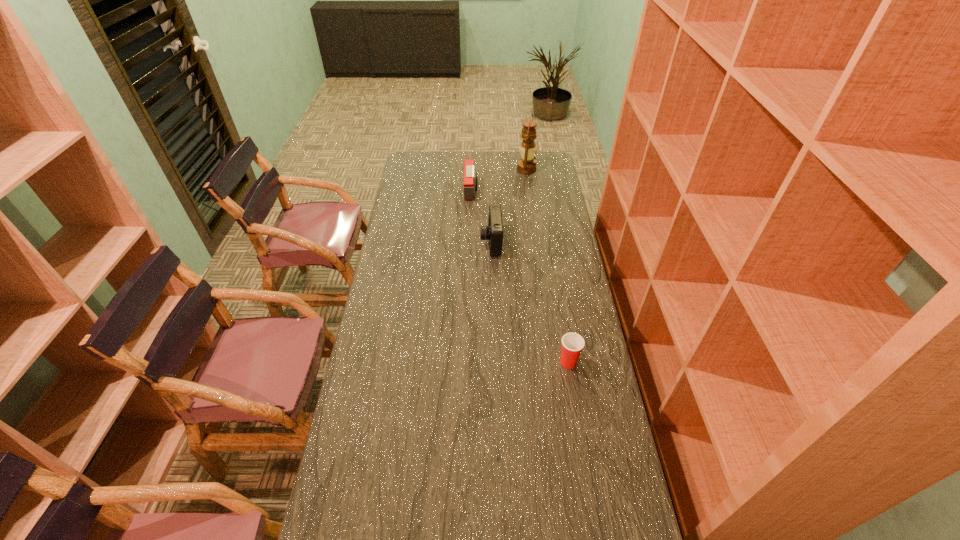
You are a GUI agent. You are given a task and a screenshot of the screen. Output one action in this format:
    pyautogui.click(x=<x>, y=<y>)
    Task: Click on the vacant space that satisfies the following two spatial constraints: 1. on the front-facing side of the farther camera; 2. on the right side of the nearest object
    
    Given the screenshot: What is the action you would take?
    (468, 362)

Where is `vacant point that satisfies the following two spatial constraints: 1. on the front side of the farthest object; 2. on the left side of the Dixie cup`? vacant point that satisfies the following two spatial constraints: 1. on the front side of the farthest object; 2. on the left side of the Dixie cup is located at coordinates (553, 362).

Find the location of a particular element. free space that satisfies the following two spatial constraints: 1. on the front-facing side of the left camera; 2. on the back side of the Dixie cup is located at coordinates (468, 362).